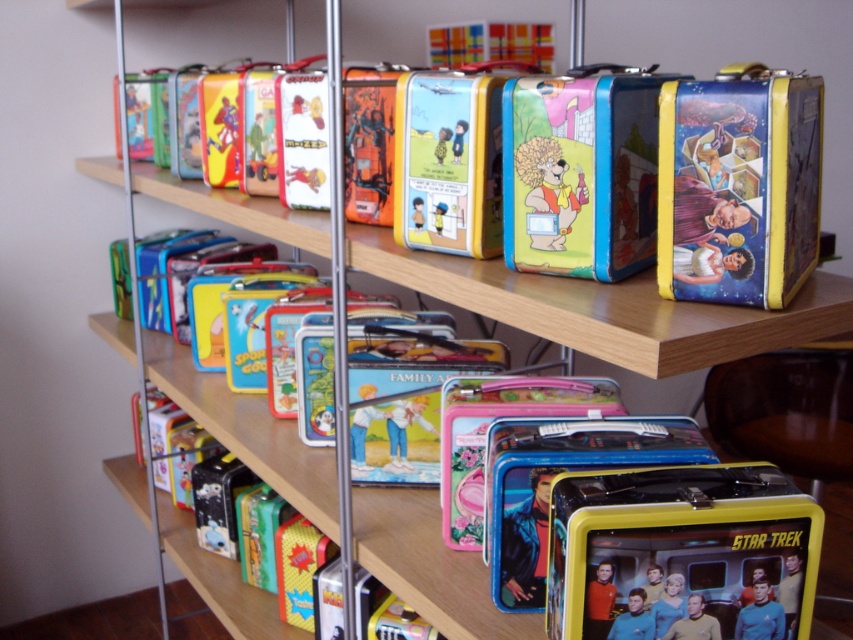
Question: Which point is closer to the camera taking this photo?

Choices:
 (A) (793, 524)
 (B) (813, 221)

Answer: (A)

Question: Which object is farther from the camera taking this photo?

Choices:
 (A) metallic yellow lunchbox at right
 (B) metallic yellow lunchbox at lower right

Answer: (B)

Question: Among these objects, which one is farthest from the camera?

Choices:
 (A) metallic yellow lunchbox at right
 (B) metallic yellow lunchbox at lower right

Answer: (B)

Question: Is metallic yellow lunchbox at lower right wider than metallic yellow lunchbox at right?

Choices:
 (A) no
 (B) yes

Answer: (B)

Question: Does metallic yellow lunchbox at lower right appear under metallic yellow lunchbox at right?

Choices:
 (A) no
 (B) yes

Answer: (B)

Question: Can you confirm if metallic yellow lunchbox at lower right is positioned above metallic yellow lunchbox at right?

Choices:
 (A) no
 (B) yes

Answer: (A)